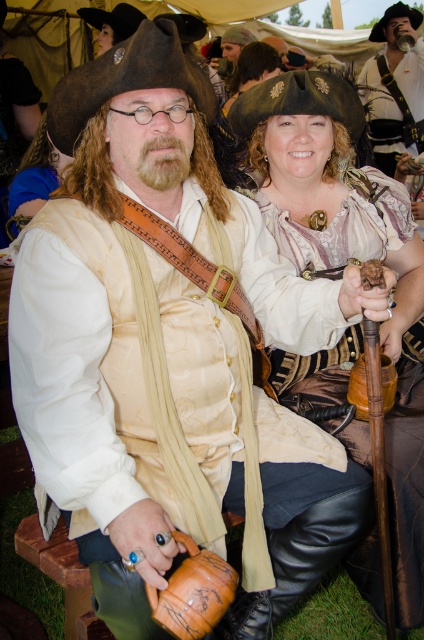
Question: Which of these objects is positioned closest to the matte gold chain at center?

Choices:
 (A) matte gold armor at center
 (B) matte white shirt at center

Answer: (A)

Question: Is matte gold chain at center positioned in front of matte white shirt at center?

Choices:
 (A) no
 (B) yes

Answer: (B)

Question: Can you confirm if matte gold chain at center is positioned below matte gold armor at center?

Choices:
 (A) yes
 (B) no

Answer: (A)

Question: Can you confirm if matte gold chain at center is thinner than matte white shirt at center?

Choices:
 (A) no
 (B) yes

Answer: (B)

Question: Based on their relative distances, which object is nearer to the matte white shirt at center?

Choices:
 (A) matte gold chain at center
 (B) matte gold armor at center

Answer: (B)

Question: Which of the following is the closest to the observer?

Choices:
 (A) (384, 83)
 (B) (401, 282)
 (C) (251, 65)

Answer: (B)